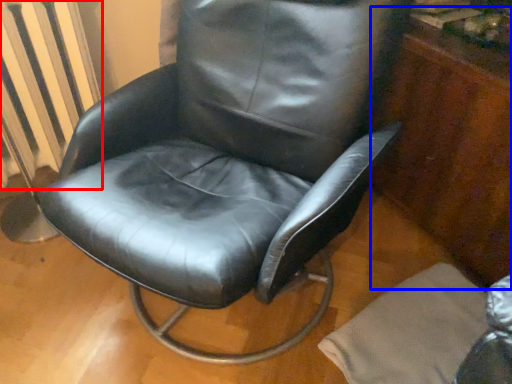
Question: Which object is closer to the camera taking this photo, radiator (highlighted by a red box) or dresser (highlighted by a blue box)?

Choices:
 (A) radiator
 (B) dresser

Answer: (B)